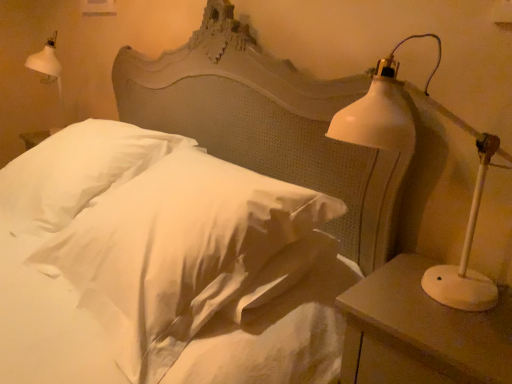
Question: Considering the positions of point (150, 157) and point (214, 193), is point (150, 157) closer or farther from the camera than point (214, 193)?

Choices:
 (A) closer
 (B) farther

Answer: (B)

Question: From a real-world perspective, relative to white satin pillow at center, which is the 2th pillow from left to right, is white soft pillow at center, the 2th pillow in the right-to-left sequence, vertically above or below?

Choices:
 (A) above
 (B) below

Answer: (B)

Question: Considering the real-world distances, which object is farthest from the white matte nightstand at right?

Choices:
 (A) white soft pillow at center, the first pillow from the left
 (B) white matte lamp at right
 (C) white satin pillow at center, which is the 2th pillow from left to right

Answer: (A)

Question: Which object is positioned farthest from the white soft pillow at center, the 2th pillow in the right-to-left sequence?

Choices:
 (A) white matte nightstand at right
 (B) white matte lamp at right
 (C) white satin pillow at center, the first pillow when ordered from right to left

Answer: (A)